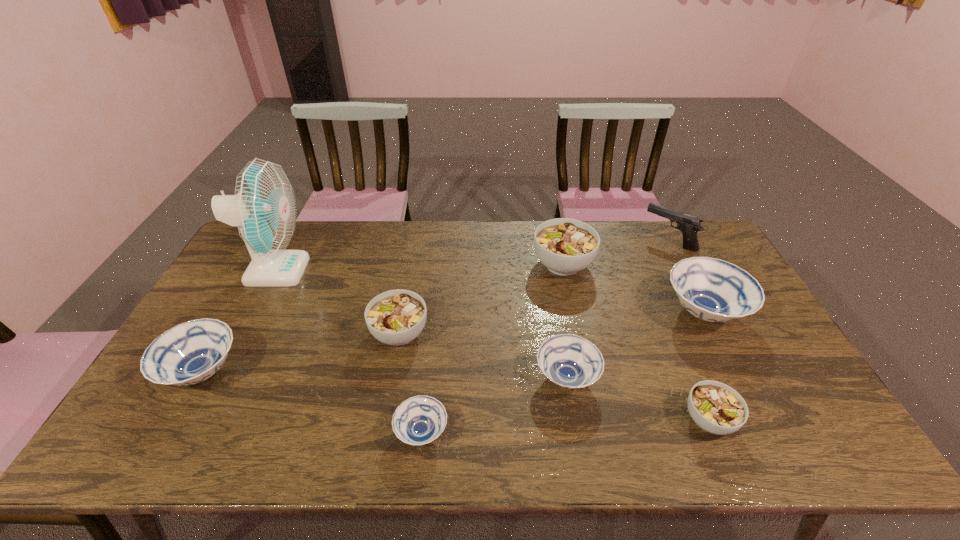
The image size is (960, 540). Identify the location of fan. (264, 208).

The width and height of the screenshot is (960, 540). What are the coordinates of `white fan` in the screenshot? It's located at (264, 208).

Locate an element on the screen. black gun is located at coordinates (689, 225).

Locate an element on the screen. Image resolution: width=960 pixels, height=540 pixels. the farthest white soup bowl is located at coordinates (565, 246).

Locate an element on the screen. The width and height of the screenshot is (960, 540). the biggest white soup bowl is located at coordinates (565, 246).

Identify the location of the biggest blue soup bowl. This screenshot has width=960, height=540. (713, 290).

Locate an element on the screen. This screenshot has width=960, height=540. the second nearest white soup bowl is located at coordinates (396, 317).

The height and width of the screenshot is (540, 960). In order to click on the leftmost white soup bowl in this screenshot , I will do `click(396, 317)`.

Identify the location of the leftmost blue soup bowl. The height and width of the screenshot is (540, 960). (191, 352).

The height and width of the screenshot is (540, 960). I want to click on the third smallest blue soup bowl, so click(191, 352).